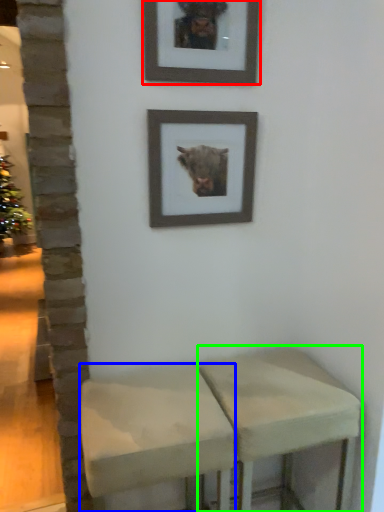
Question: Which object is positioned closest to picture frame (highlighted by a red box)? Select from stool (highlighted by a blue box) and stool (highlighted by a green box).

Choices:
 (A) stool
 (B) stool

Answer: (A)